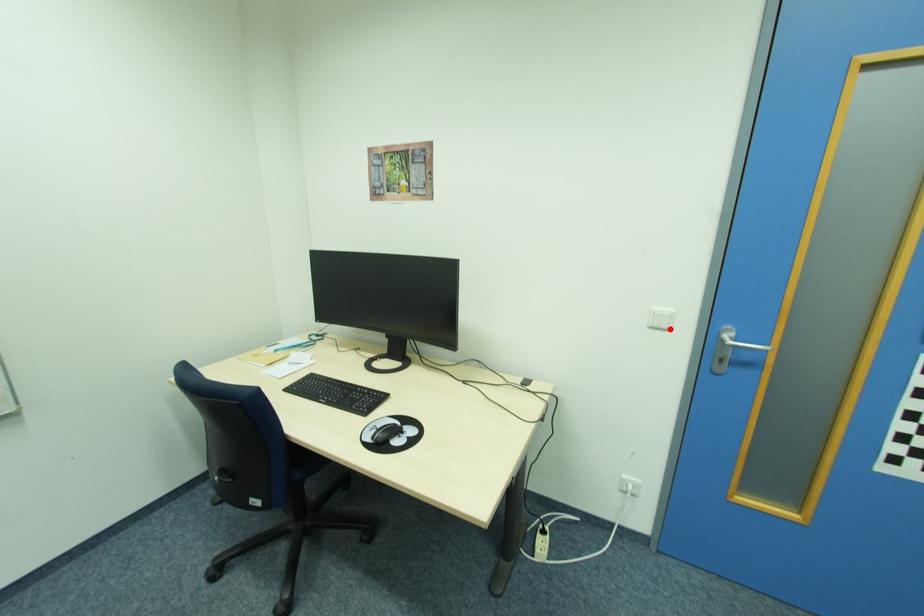
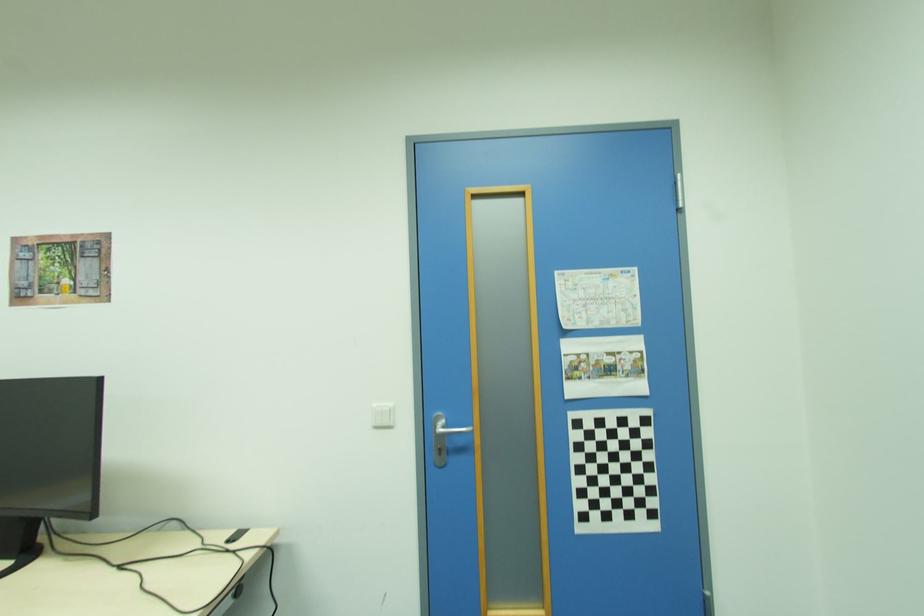
Find the pixel in the second image that matches the highlighted location in the first image.

(394, 427)